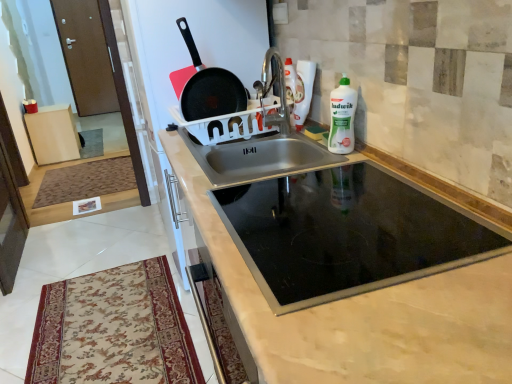
Question: From a real-world perspective, is white plastic bottle at upper right beneath brown textured mat at lower left, marked as the first mat in a top-to-bottom arrangement?

Choices:
 (A) no
 (B) yes

Answer: (A)

Question: From the image's perspective, is white plastic bottle at upper right located beneath brown textured mat at lower left, the 1th mat from the left?

Choices:
 (A) yes
 (B) no

Answer: (B)

Question: Could you tell me if white plastic bottle at upper right is facing brown textured mat at lower left, which is the first mat from back to front?

Choices:
 (A) yes
 (B) no

Answer: (B)

Question: From the image's perspective, would you say white plastic bottle at upper right is positioned over brown textured mat at lower left, which is the first mat from back to front?

Choices:
 (A) no
 (B) yes

Answer: (B)

Question: From a real-world perspective, is white plastic bottle at upper right over brown textured mat at lower left, which is the first mat from back to front?

Choices:
 (A) yes
 (B) no

Answer: (A)

Question: From a real-world perspective, is beige floral rug at lower left, placed as the first mat when sorted from bottom to top, above or below black matte frying pan at upper center?

Choices:
 (A) below
 (B) above

Answer: (A)

Question: In terms of width, does beige floral rug at lower left, the 1th mat from the right, look wider or thinner when compared to black matte frying pan at upper center?

Choices:
 (A) wide
 (B) thin

Answer: (A)

Question: From the image's perspective, is beige floral rug at lower left, which is counted as the second mat, starting from the top, positioned above or below black matte frying pan at upper center?

Choices:
 (A) below
 (B) above

Answer: (A)

Question: Considering the positions of point (172, 332) and point (194, 119), is point (172, 332) closer or farther from the camera than point (194, 119)?

Choices:
 (A) closer
 (B) farther

Answer: (B)

Question: Relative to white plastic bottle at upper right, is brown wooden door at upper left in front or behind?

Choices:
 (A) front
 (B) behind

Answer: (B)

Question: In terms of height, does brown wooden door at upper left look taller or shorter compared to white plastic bottle at upper right?

Choices:
 (A) short
 (B) tall

Answer: (B)

Question: From the image's perspective, is brown wooden door at upper left positioned above or below white plastic bottle at upper right?

Choices:
 (A) above
 (B) below

Answer: (A)

Question: Is point (65, 14) positioned closer to the camera than point (342, 84)?

Choices:
 (A) closer
 (B) farther

Answer: (B)

Question: In the image, is black glass cooktop at center positioned in front of or behind brown wooden door at upper left?

Choices:
 (A) front
 (B) behind

Answer: (A)

Question: Visually, is black glass cooktop at center positioned to the left or to the right of brown wooden door at upper left?

Choices:
 (A) left
 (B) right

Answer: (B)